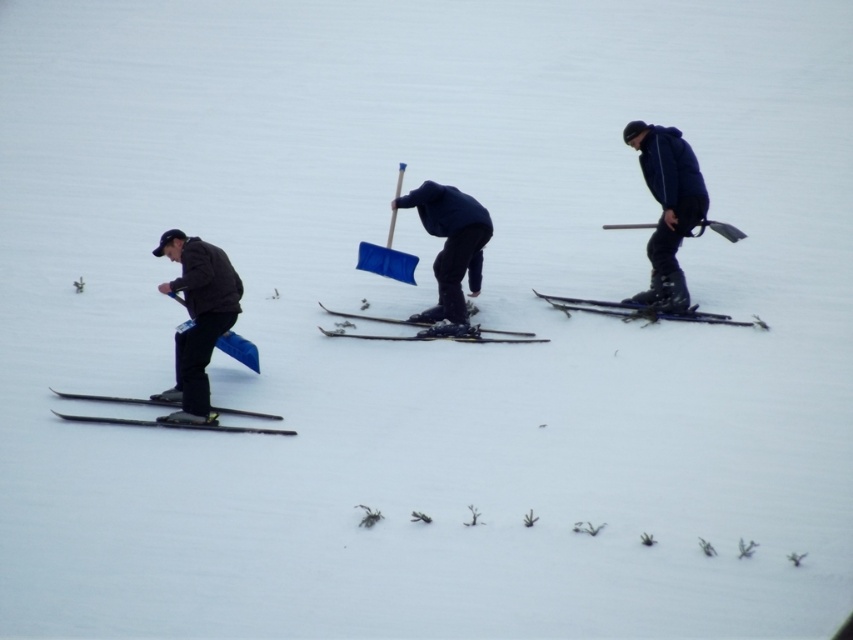
You are planning to carry a 10 cm thick snowboard. You see the dark blue jacket at right and the black matte skis at left. Which object can the snowboard fit under?

The dark blue jacket at right is thinner than the black matte skis at left, so the snowboard can fit under the dark blue jacket at right.

You are standing at the center of the snowy path and see the dark blue jacket at right and the black matte skis at left. Which object is closer to your right side?

The dark blue jacket at right is closer to your right side because it is positioned to the right of the black matte skis at left.

You are standing at the back of the snowy landscape and want to hand a hot drink to both the dark brown jacket at left and the dark blue jacket at right. Which person should you approach first based on their position?

You should approach the dark brown jacket at left first because they are closer to you than the dark blue jacket at right, so you can reach them more quickly.